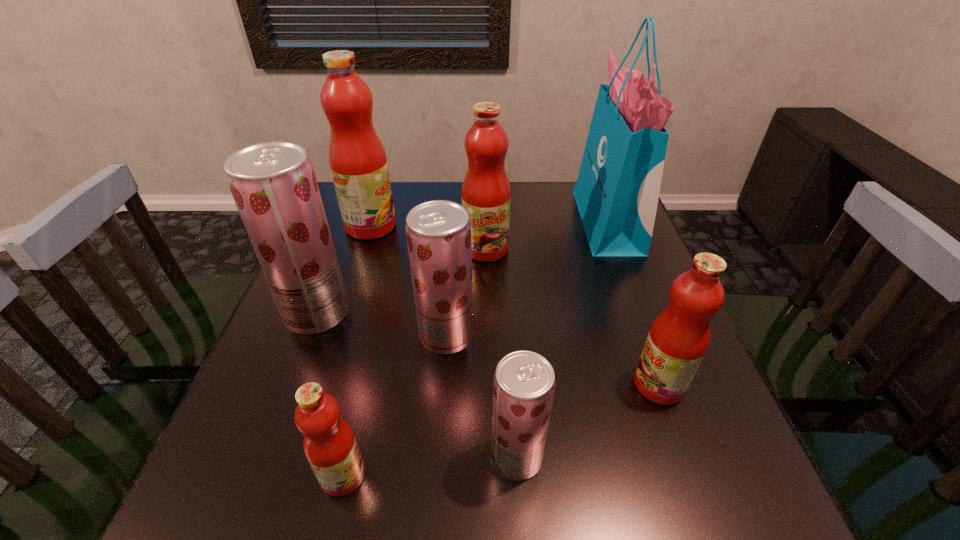
Where is `shopping bag present at the far edge`? Image resolution: width=960 pixels, height=540 pixels. shopping bag present at the far edge is located at coordinates (617, 190).

Locate an element on the screen. fruit juice positioned at the far edge is located at coordinates 357,159.

Locate an element on the screen. shopping bag at the right edge is located at coordinates coord(617,190).

At what (x,y) coordinates should I click in order to perform the action: click on fruit juice positioned at the right edge. Please return your answer as a coordinate pair (x, y). The width and height of the screenshot is (960, 540). Looking at the image, I should click on (679, 337).

Where is `object present at the far left corner`? object present at the far left corner is located at coordinates (357, 159).

At what (x,y) coordinates should I click in order to perform the action: click on object present at the far right corner. Please return your answer as a coordinate pair (x, y). This screenshot has width=960, height=540. Looking at the image, I should click on (617, 190).

Image resolution: width=960 pixels, height=540 pixels. In the image, there is a desktop. What are the coordinates of `vacant space at the far edge` in the screenshot? It's located at (567, 201).

This screenshot has height=540, width=960. In the image, there is a desktop. Identify the location of vacant space at the near edge. tap(431, 482).

This screenshot has width=960, height=540. What are the coordinates of `free space at the right edge of the desktop` in the screenshot? It's located at (596, 262).

Find the location of a particular element. The image size is (960, 540). vacant space at the near right corner of the desktop is located at coordinates (732, 475).